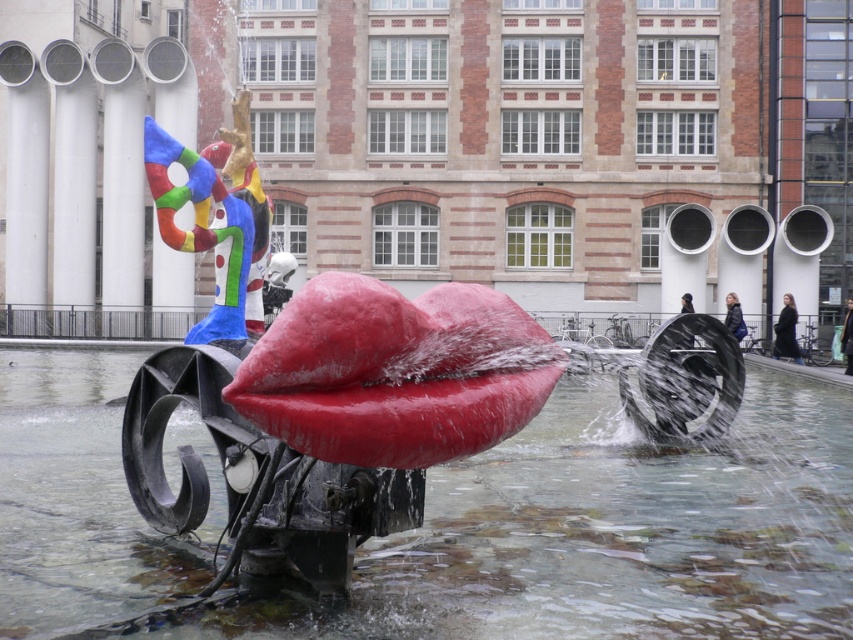
Who is positioned more to the right, glossy water at lips center or dark hair person at center?

dark hair person at center

Does glossy water at lips center come behind dark hair person at center?

No, glossy water at lips center is in front of dark hair person at center.

The height and width of the screenshot is (640, 853). What are the coordinates of `glossy water at lips center` in the screenshot? It's located at (613, 532).

This screenshot has height=640, width=853. I want to click on glossy water at lips center, so click(613, 532).

Is dark hair person at center taller than dark hair at center?

Yes.

Who is positioned more to the left, dark hair person at center or dark hair at center?

dark hair at center is more to the left.

What do you see at coordinates (846, 337) in the screenshot?
I see `dark hair person at center` at bounding box center [846, 337].

Where is `dark hair person at center`? This screenshot has width=853, height=640. dark hair person at center is located at coordinates (846, 337).

Is dark gray coat at lower right in front of dark hair person at center?

No, it is not.

The image size is (853, 640). Find the location of `dark gray coat at lower right`. dark gray coat at lower right is located at coordinates (786, 332).

What do you see at coordinates (786, 332) in the screenshot?
I see `dark gray coat at lower right` at bounding box center [786, 332].

At what (x,y) coordinates should I click in order to perform the action: click on dark gray coat at lower right. Please return your answer as a coordinate pair (x, y). Looking at the image, I should click on (786, 332).